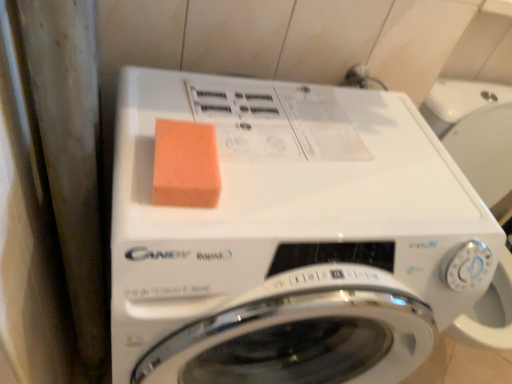
Question: Should I look upward or downward to see white glossy washing machine at center?

Choices:
 (A) up
 (B) down

Answer: (B)

Question: Is white glossy washing machine at center facing towards orange sponge at upper center?

Choices:
 (A) yes
 (B) no

Answer: (B)

Question: Is orange sponge at upper center inside white glossy washing machine at center?

Choices:
 (A) no
 (B) yes

Answer: (B)

Question: Is white glossy washing machine at center completely or partially outside of orange sponge at upper center?

Choices:
 (A) yes
 (B) no

Answer: (A)

Question: Does white glossy washing machine at center have a larger size compared to orange sponge at upper center?

Choices:
 (A) no
 (B) yes

Answer: (B)

Question: Is white glossy washing machine at center shorter than orange sponge at upper center?

Choices:
 (A) yes
 (B) no

Answer: (B)

Question: Does white glossy washing machine at center have a greater height compared to orange sponge at upper center?

Choices:
 (A) no
 (B) yes

Answer: (B)

Question: Does orange sponge at upper center have a larger size compared to white glossy washing machine at center?

Choices:
 (A) yes
 (B) no

Answer: (B)

Question: Is orange sponge at upper center in front of white glossy washing machine at center?

Choices:
 (A) no
 (B) yes

Answer: (A)

Question: Is orange sponge at upper center turned away from white glossy washing machine at center?

Choices:
 (A) yes
 (B) no

Answer: (B)

Question: Considering the relative positions of orange sponge at upper center and white glossy washing machine at center in the image provided, is orange sponge at upper center to the right of white glossy washing machine at center from the viewer's perspective?

Choices:
 (A) no
 (B) yes

Answer: (A)

Question: Is orange sponge at upper center taller than white glossy washing machine at center?

Choices:
 (A) no
 (B) yes

Answer: (A)

Question: From a real-world perspective, is orange sponge at upper center physically above white glossy washing machine at center?

Choices:
 (A) no
 (B) yes

Answer: (B)

Question: Considering the positions of orange sponge at upper center and white glossy washing machine at center in the image, is orange sponge at upper center wider or thinner than white glossy washing machine at center?

Choices:
 (A) thin
 (B) wide

Answer: (A)